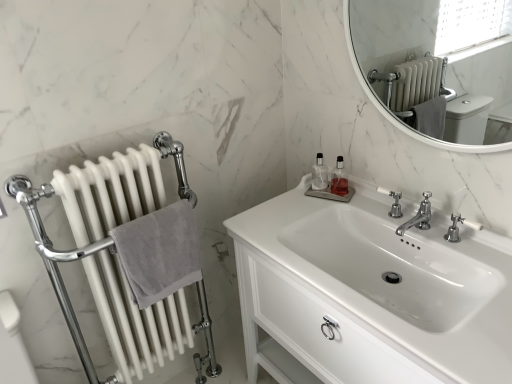
You are a GUI agent. You are given a task and a screenshot of the screen. Output one action in this format:
    pyautogui.click(x=<x>, y=<y>)
    Task: Click on the vacant area that lies in front of polished chrome faucet at right, the second tap when ordered from left to right
    The height and width of the screenshot is (384, 512).
    Given the screenshot: What is the action you would take?
    pyautogui.click(x=484, y=269)